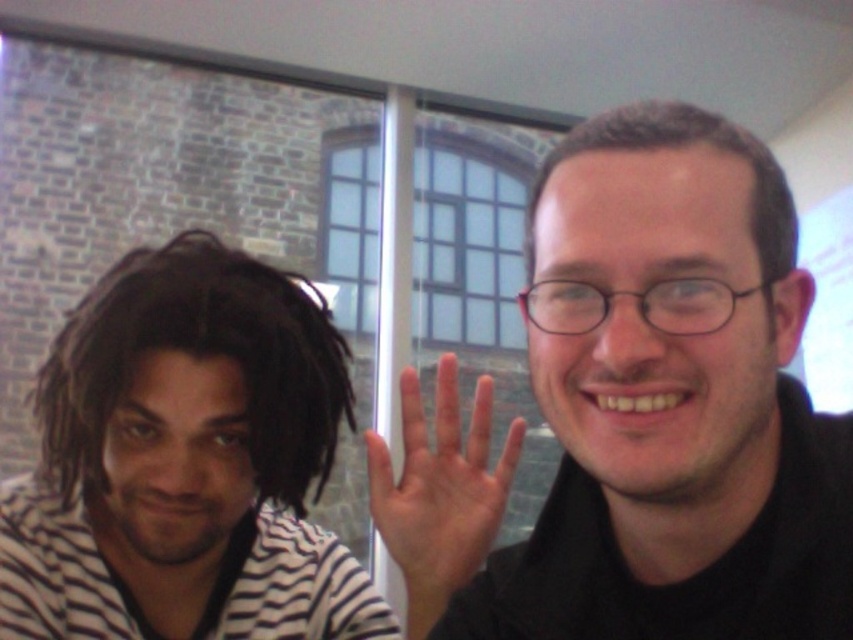
Question: Among these points, which one is nearest to the camera?

Choices:
 (A) (65, 461)
 (B) (700, 195)

Answer: (B)

Question: Among these objects, which one is nearest to the camera?

Choices:
 (A) black matte glasses at upper right
 (B) dark brown dreadlocks at left
 (C) skinny white hand at center
 (D) dark brown hair at upper right

Answer: (A)

Question: Is dark brown dreadlocks at left smaller than skinny white hand at center?

Choices:
 (A) yes
 (B) no

Answer: (B)

Question: Does black matte glasses at upper right have a larger size compared to dark brown dreadlocks at left?

Choices:
 (A) no
 (B) yes

Answer: (B)

Question: Does skinny white hand at center appear over dark brown hair at upper right?

Choices:
 (A) no
 (B) yes

Answer: (A)

Question: Considering the real-world distances, which object is farthest from the dark brown hair at upper right?

Choices:
 (A) black matte glasses at upper right
 (B) skinny white hand at center
 (C) dark brown dreadlocks at left

Answer: (C)